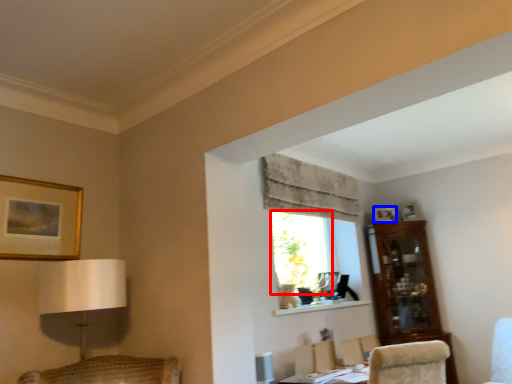
Question: Among these objects, which one is farthest to the camera, window (highlighted by a red box) or picture frame (highlighted by a blue box)?

Choices:
 (A) window
 (B) picture frame

Answer: (B)